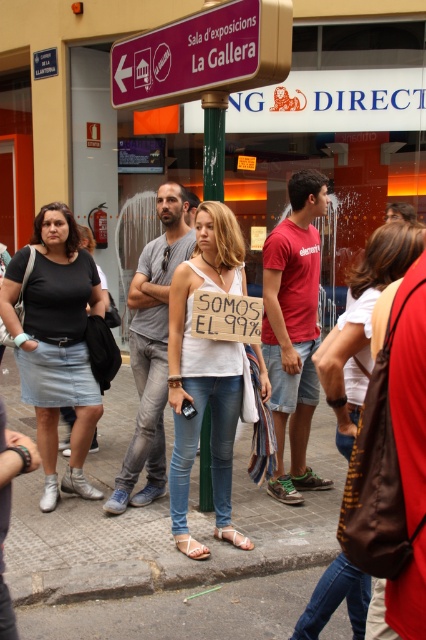
Question: Which of these objects is positioned farthest from the gray concrete pavement at center?

Choices:
 (A) red cotton t-shirt at center
 (B) denim skirt at left
 (C) white cotton tank top at center
 (D) denim jeans at center

Answer: (B)

Question: Among these objects, which one is nearest to the camera?

Choices:
 (A) denim skirt at left
 (B) denim jeans at center
 (C) red cotton t-shirt at center
 (D) purple plastic sign at upper center

Answer: (D)

Question: Considering the relative positions of gray concrete pavement at center and purple plastic sign at upper center in the image provided, where is gray concrete pavement at center located with respect to purple plastic sign at upper center?

Choices:
 (A) below
 (B) above

Answer: (A)

Question: Can you confirm if denim skirt at left is smaller than denim jeans at center?

Choices:
 (A) no
 (B) yes

Answer: (B)

Question: Which object is positioned farthest from the purple plastic sign at upper center?

Choices:
 (A) denim jeans at center
 (B) denim skirt at left
 (C) red cotton t-shirt at center
 (D) gray concrete pavement at center

Answer: (D)

Question: Can you confirm if gray concrete pavement at center is bigger than purple plastic sign at upper center?

Choices:
 (A) yes
 (B) no

Answer: (A)